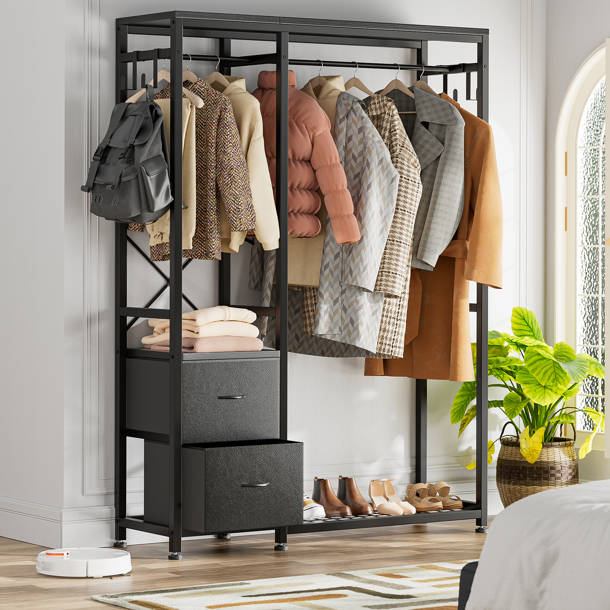
Image resolution: width=610 pixels, height=610 pixels. What are the coordinates of `rack legs` in the screenshot? It's located at (120, 533), (171, 549), (220, 540), (279, 547), (483, 520).